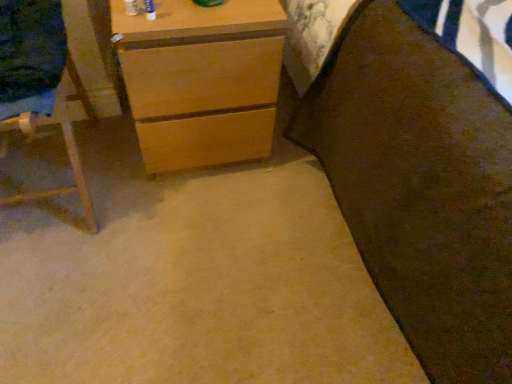
Question: From the image's perspective, is light brown wood chest of drawers at upper left above or below wooden easel at left?

Choices:
 (A) below
 (B) above

Answer: (B)

Question: Is light brown wood chest of drawers at upper left taller or shorter than wooden easel at left?

Choices:
 (A) tall
 (B) short

Answer: (B)

Question: Based on their relative distances, which object is nearer to the wooden easel at left?

Choices:
 (A) brown fabric bed at right
 (B) light brown wood chest of drawers at upper left

Answer: (B)

Question: Considering the real-world distances, which object is closest to the brown fabric bed at right?

Choices:
 (A) wooden easel at left
 (B) light brown wood chest of drawers at upper left

Answer: (B)